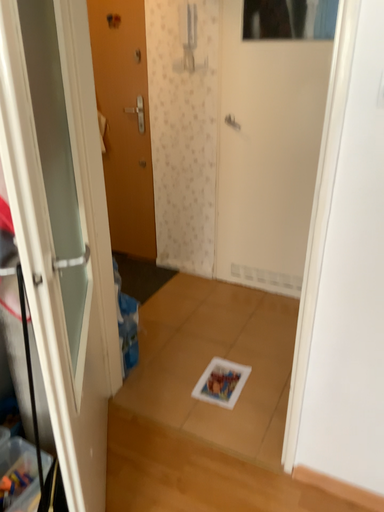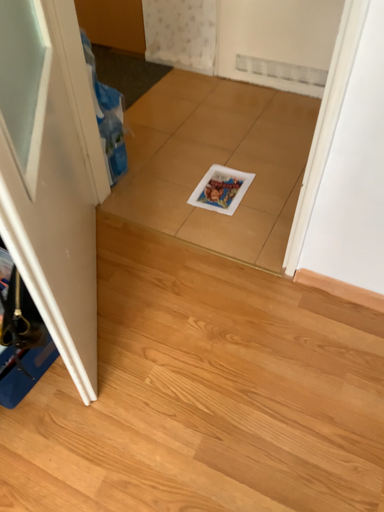
Question: Which way did the camera rotate in the video?

Choices:
 (A) rotated upward
 (B) rotated downward

Answer: (B)